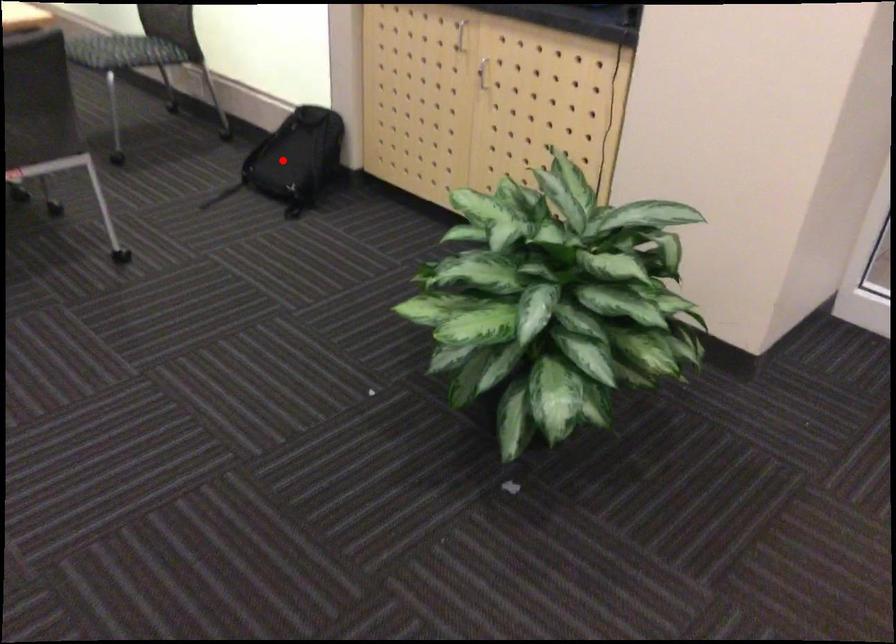
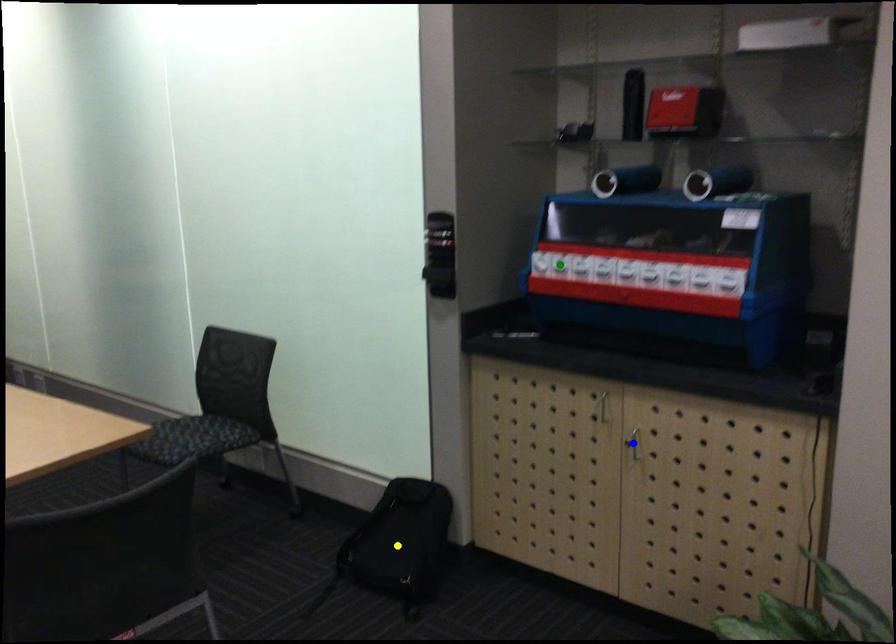
Question: I am providing you with two images of the same scene from different viewpoints. A red point is marked on the first image. You are given multiple points on the second image. Which spot in image 2 lines up with the point in image 1?

Choices:
 (A) yellow point
 (B) blue point
 (C) green point

Answer: (A)